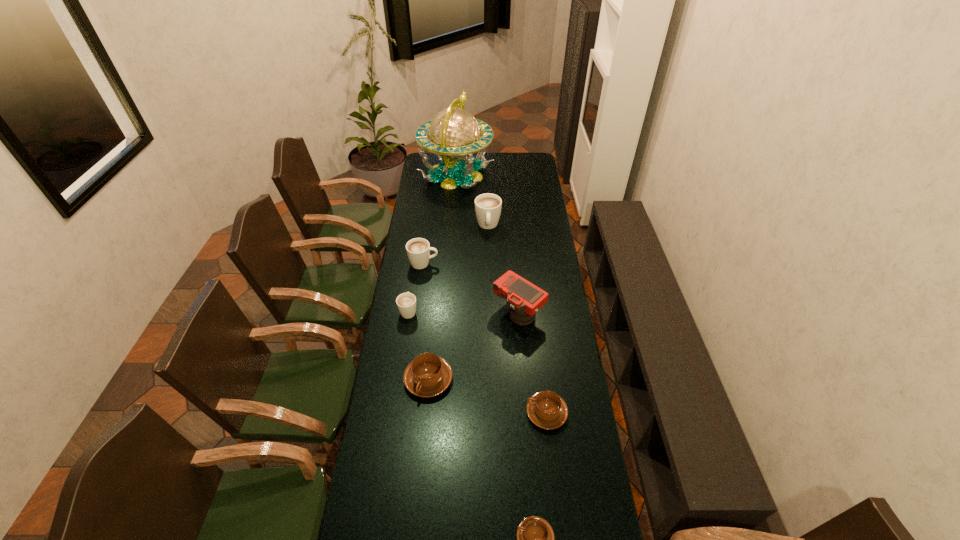
Where is `white cappuccino that is the nearest to the second biggest brown cappuccino`? The image size is (960, 540). white cappuccino that is the nearest to the second biggest brown cappuccino is located at coordinates (406, 302).

Locate an element on the screen. This screenshot has width=960, height=540. white cappuccino that can be found as the third closest to the leftmost brown cappuccino is located at coordinates (488, 206).

Identify the location of the closest brown cappuccino to the second biggest brown cappuccino. (428, 375).

Locate which brown cappuccino is the second closest to the camera. Please provide its 2D coordinates. Your answer should be formatted as a tuple, i.e. [(x, y)], where the tuple contains the x and y coordinates of a point satisfying the conditions above.

[(547, 410)]

The height and width of the screenshot is (540, 960). I want to click on free space that satisfies the following two spatial constraints: 1. with the handle on the side of the fifth nearest cappuccino; 2. on the left side of the camera, so click(x=417, y=313).

Find the location of a particular element. The image size is (960, 540). vacant space that satisfies the following two spatial constraints: 1. with the handle on the side of the biggest white cappuccino; 2. on the left side of the camera is located at coordinates (490, 313).